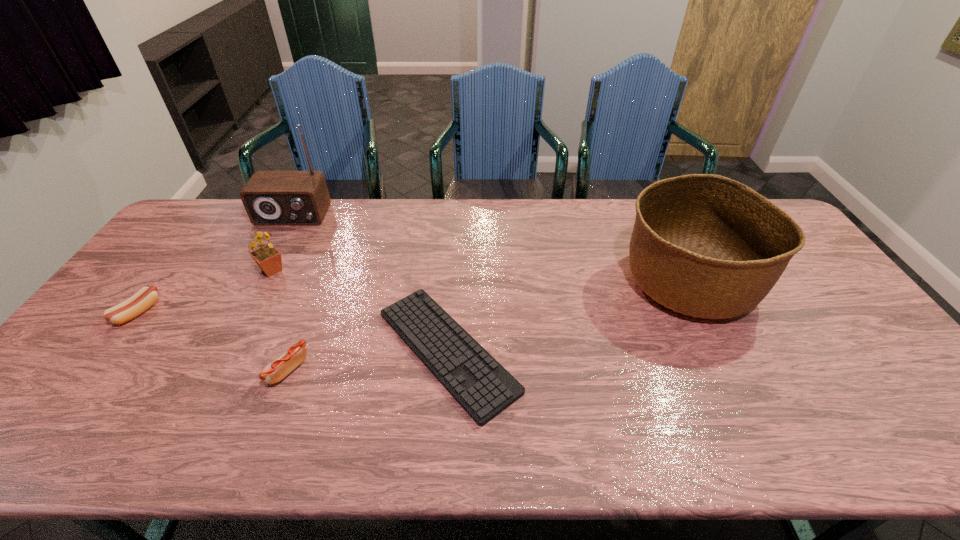
Image resolution: width=960 pixels, height=540 pixels. What are the coordinates of `vacant space at the far edge of the desktop` in the screenshot? It's located at (624, 208).

Where is `vacant space at the near edge of the desktop`? vacant space at the near edge of the desktop is located at coordinates (630, 434).

Find the location of a particular element. This screenshot has height=540, width=960. free space at the left edge of the desktop is located at coordinates (178, 244).

This screenshot has height=540, width=960. In order to click on free space at the right edge of the desktop in this screenshot , I will do `click(800, 302)`.

The height and width of the screenshot is (540, 960). Find the location of `unoccupied area between the computer keyboard and the right sausage`. unoccupied area between the computer keyboard and the right sausage is located at coordinates 368,360.

Locate an element on the screen. The image size is (960, 540). empty space between the third object from right to left and the fourth shortest object is located at coordinates (280, 320).

In order to click on vacant region between the sunflower and the second tallest object in this screenshot , I will do `click(480, 276)`.

Find the location of `free space that is in between the fourth object from left to right and the tallest object`. free space that is in between the fourth object from left to right and the tallest object is located at coordinates (290, 292).

At what (x,y) coordinates should I click in order to perform the action: click on blank region between the second tallest object and the right sausage. Please return your answer as a coordinate pair (x, y). The width and height of the screenshot is (960, 540). Looking at the image, I should click on (488, 326).

Image resolution: width=960 pixels, height=540 pixels. Identify the location of free space between the sunflower and the second tallest object. (480, 276).